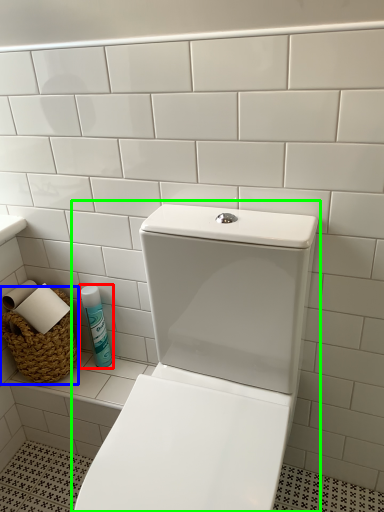
Question: Which is farther away from cleaning product (highlighted by a red box)? basket (highlighted by a blue box) or toilet (highlighted by a green box)?

Choices:
 (A) basket
 (B) toilet

Answer: (B)